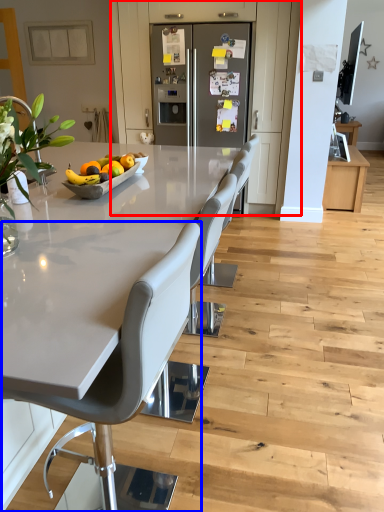
Question: Among these objects, which one is farthest to the camera, cabinetry (highlighted by a red box) or chair (highlighted by a blue box)?

Choices:
 (A) cabinetry
 (B) chair

Answer: (A)